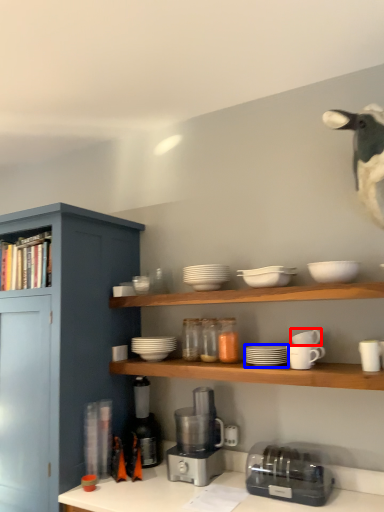
Question: Among these objects, which one is farthest to the camera, tableware (highlighted by a red box) or tableware (highlighted by a blue box)?

Choices:
 (A) tableware
 (B) tableware

Answer: (A)